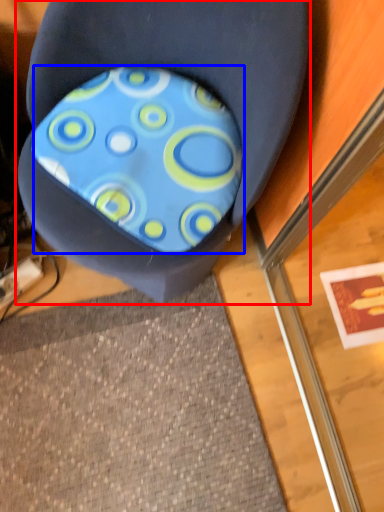
Question: Which of the following is the closest to the observer, chair (highlighted by a red box) or design (highlighted by a blue box)?

Choices:
 (A) chair
 (B) design

Answer: (A)